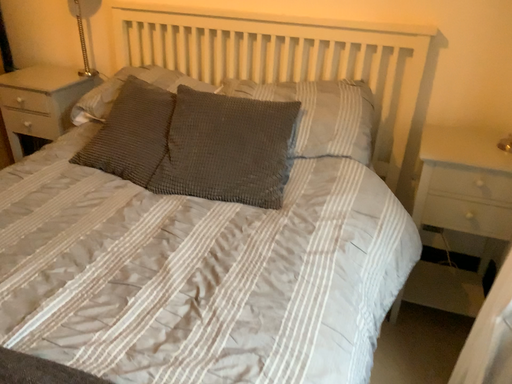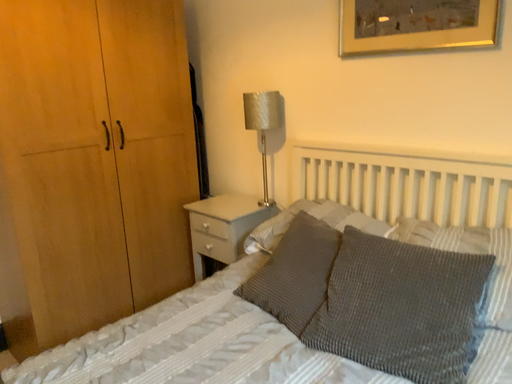
Question: How did the camera likely rotate when shooting the video?

Choices:
 (A) rotated downward
 (B) rotated upward

Answer: (B)